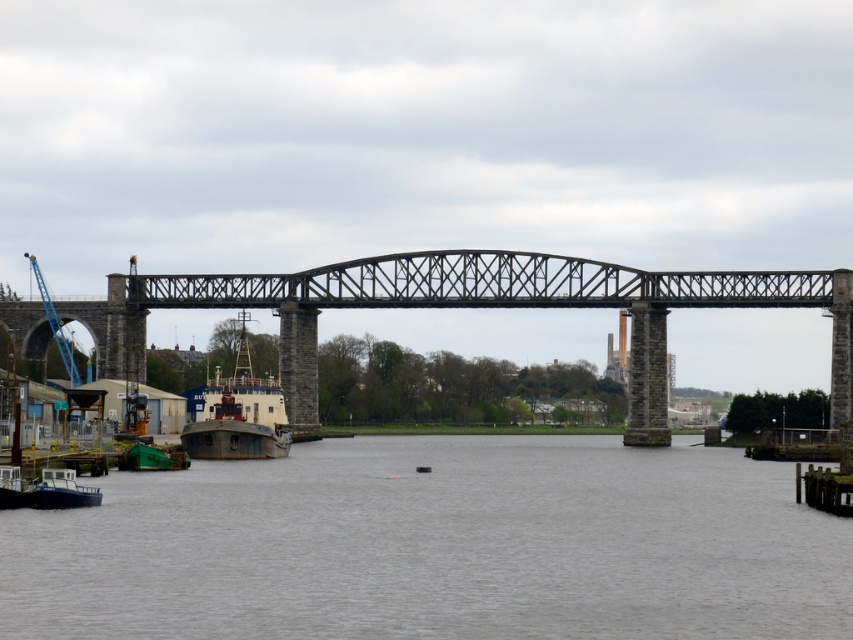
Which is above, gray concrete water at center or blue metallic crane at left?

blue metallic crane at left

You are a GUI agent. You are given a task and a screenshot of the screen. Output one action in this format:
    pyautogui.click(x=<x>, y=<y>)
    Task: Click on the gray concrete water at center
    The width and height of the screenshot is (853, 640).
    Given the screenshot: What is the action you would take?
    pyautogui.click(x=436, y=545)

Image resolution: width=853 pixels, height=640 pixels. What do you see at coordinates (436, 545) in the screenshot?
I see `gray concrete water at center` at bounding box center [436, 545].

Locate an element on the screen. This screenshot has width=853, height=640. gray concrete water at center is located at coordinates (436, 545).

Is point (755, 512) positioned after point (302, 333)?

No.

The width and height of the screenshot is (853, 640). Describe the element at coordinates (436, 545) in the screenshot. I see `gray concrete water at center` at that location.

Where is `gray concrete water at center`? gray concrete water at center is located at coordinates (436, 545).

Can you confirm if gray concrete water at center is smaller than blue matte boat at lower left?

No.

Who is shorter, gray concrete water at center or blue matte boat at lower left?

With less height is blue matte boat at lower left.

Is point (694, 467) farther from camera compared to point (50, 499)?

Yes, point (694, 467) is farther from viewer.

Locate an element on the screen. Image resolution: width=853 pixels, height=640 pixels. gray concrete water at center is located at coordinates (x=436, y=545).